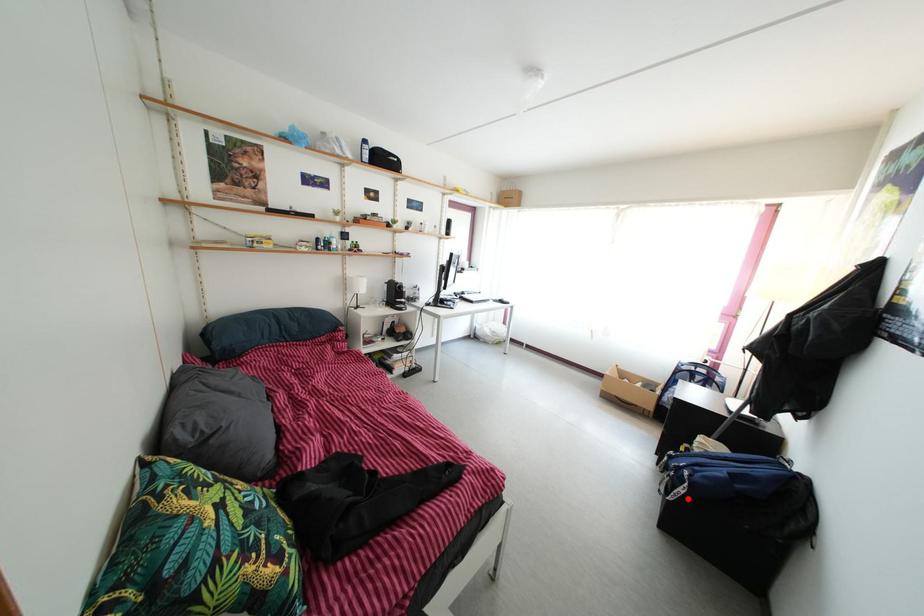
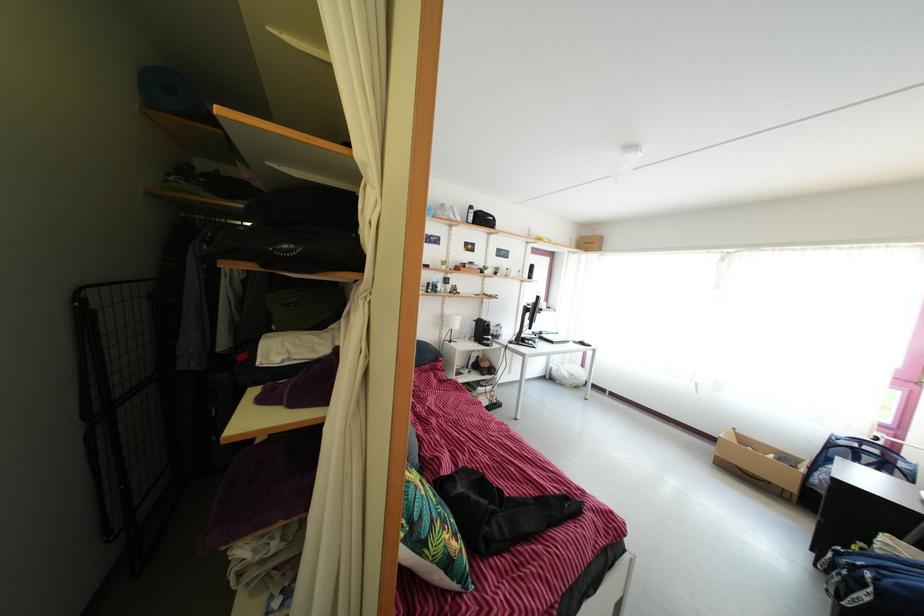
Where in the second image is the point corresponding to the highlighted location from the first image?

(870, 605)